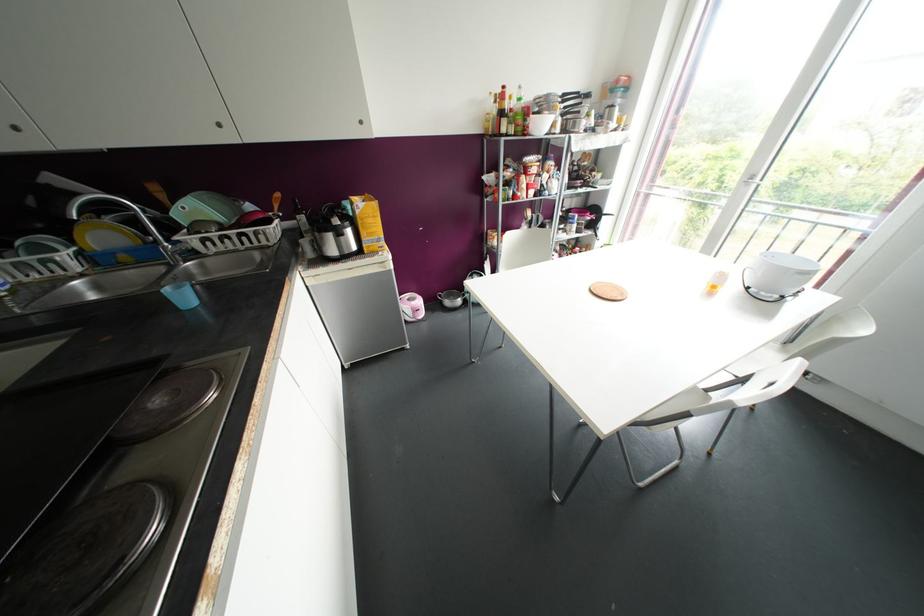
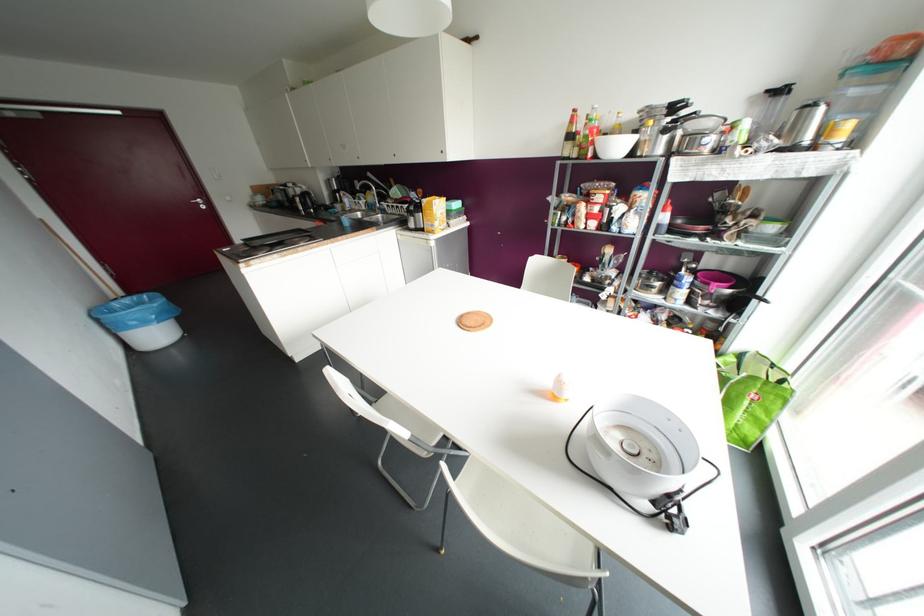
Where in the second image is the point corresponding to pixel 357 211 from the first image?

(421, 204)